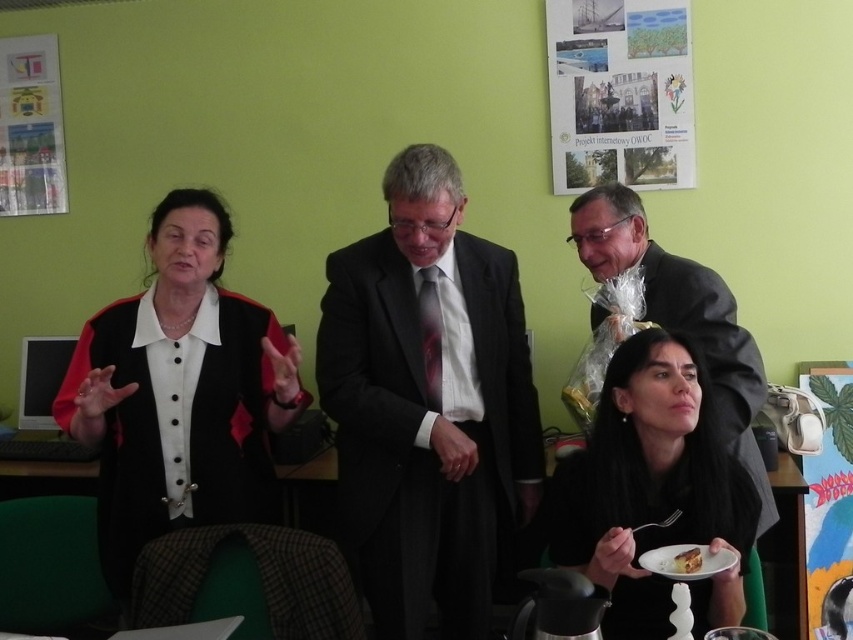
You are a photographer setting up for an event. You have a matte black suit at center and a white cake at lower right in your frame. Which object should you adjust your camera focus to prioritize if you want to ensure that the larger object is in sharp focus?

The matte black suit at center is larger in size than the white cake at lower right, so you should prioritize focusing on the matte black suit at center to ensure it is in sharp focus.